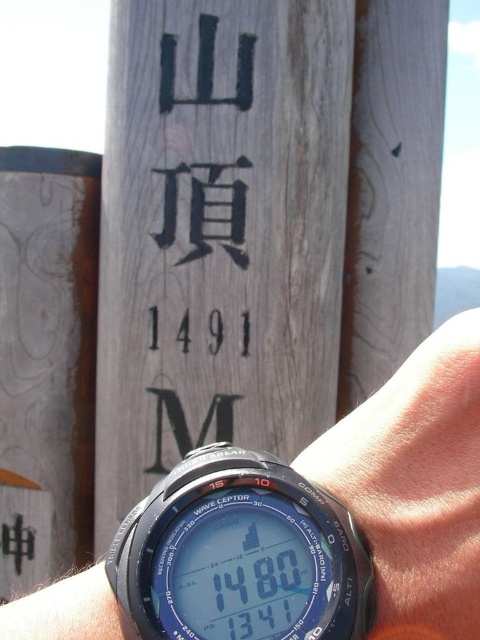
Question: Can you confirm if black plastic digital watch at center is positioned below black rubber watch at center?

Choices:
 (A) yes
 (B) no

Answer: (B)

Question: From the image, what is the correct spatial relationship of black plastic digital watch at center in relation to black rubber watch at center?

Choices:
 (A) right
 (B) left

Answer: (B)

Question: Does black plastic digital watch at center appear over black rubber watch at center?

Choices:
 (A) no
 (B) yes

Answer: (B)